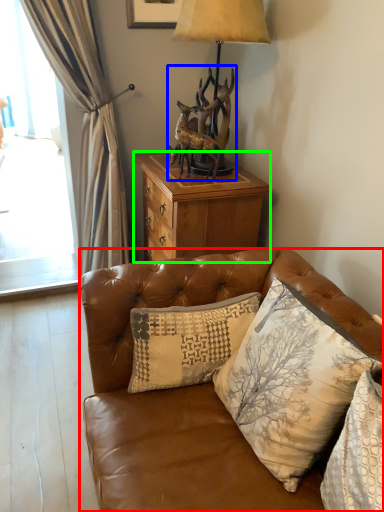
Question: Which object is the farthest from studio couch (highlighted by a red box)? Choose among these: animal (highlighted by a blue box) or desk (highlighted by a green box).

Choices:
 (A) animal
 (B) desk

Answer: (A)